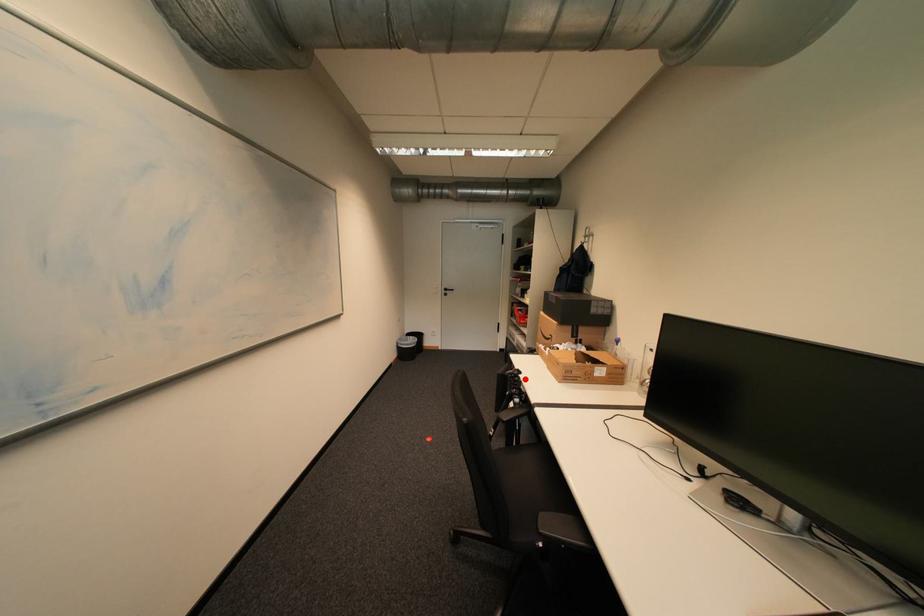
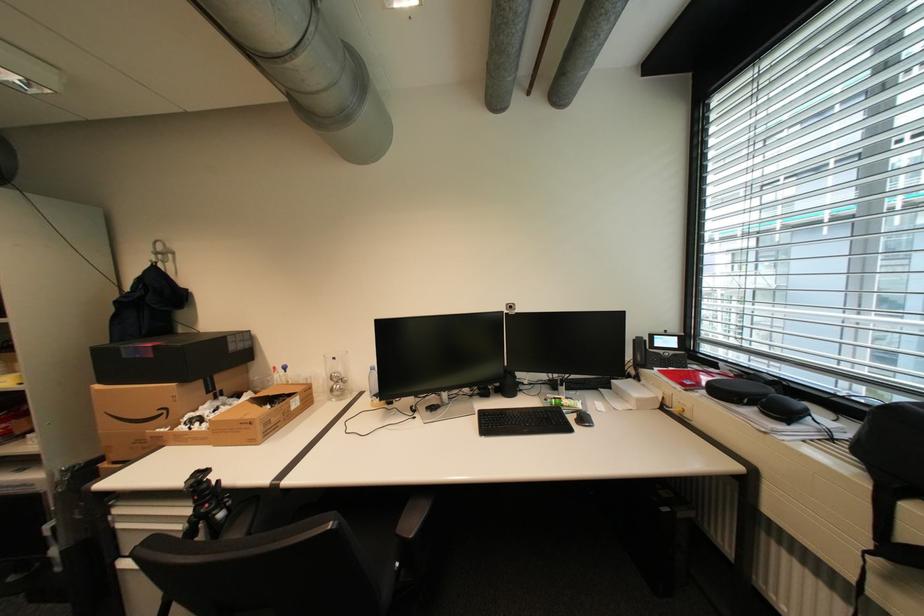
In the second image, find the point that corresponds to the highlighted location in the first image.

(213, 485)